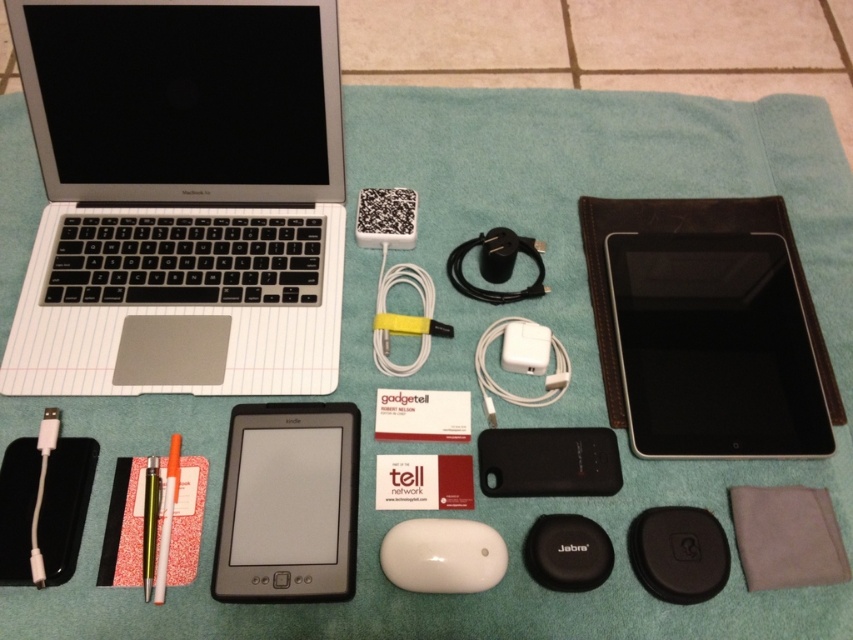
Who is more forward, (38, 58) or (273, 541)?

Positioned in front is point (273, 541).

The height and width of the screenshot is (640, 853). Describe the element at coordinates (180, 196) in the screenshot. I see `silver/black plastic laptop at upper left` at that location.

Who is more forward, (164, 32) or (323, 572)?

Positioned in front is point (323, 572).

This screenshot has width=853, height=640. Identify the location of silver/black plastic laptop at upper left. (180, 196).

Can you confirm if black leather tablet at upper right is thinner than white matte pen at lower left?

In fact, black leather tablet at upper right might be wider than white matte pen at lower left.

Where is `black leather tablet at upper right`? This screenshot has width=853, height=640. black leather tablet at upper right is located at coordinates (686, 232).

Who is taller, silver/black plastic laptop at upper left or black leather tablet at upper right?

silver/black plastic laptop at upper left

Does silver/black plastic laptop at upper left have a greater width compared to black leather tablet at upper right?

Indeed, silver/black plastic laptop at upper left has a greater width compared to black leather tablet at upper right.

What do you see at coordinates (180, 196) in the screenshot? This screenshot has width=853, height=640. I see `silver/black plastic laptop at upper left` at bounding box center [180, 196].

Image resolution: width=853 pixels, height=640 pixels. Identify the location of silver/black plastic laptop at upper left. (180, 196).